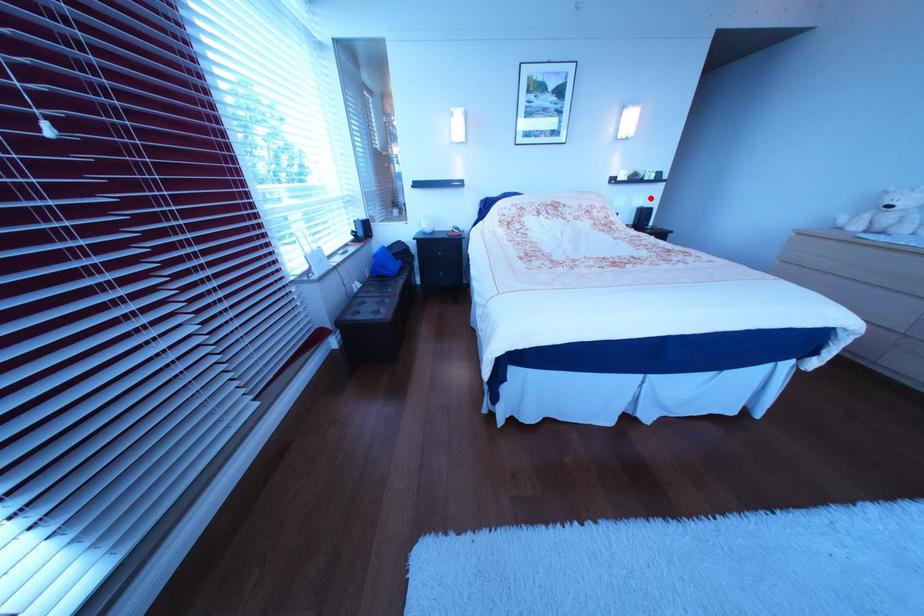
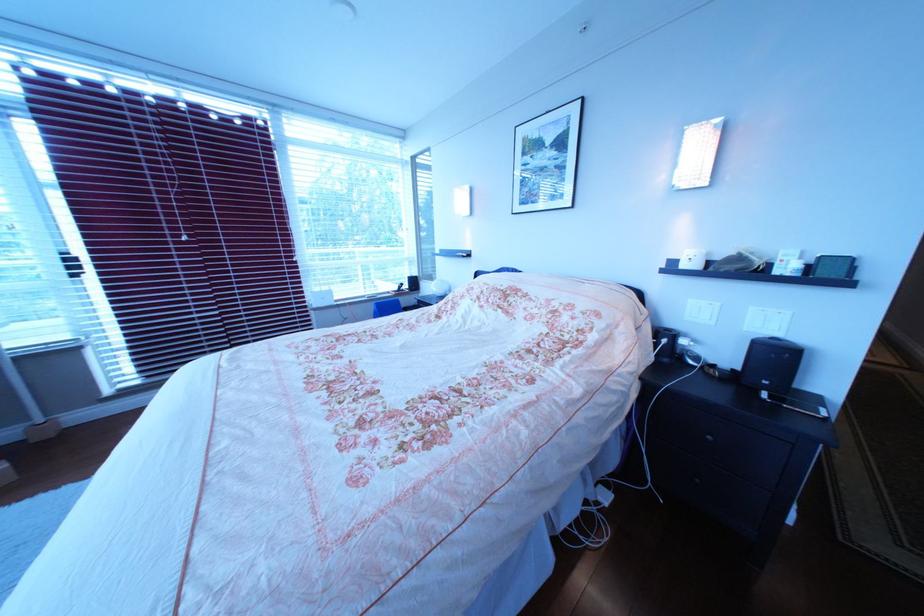
Question: A red point is marked in image1. In image2, is the corresponding 3D point closer to the camera or farther? Reply with the corresponding letter.

Choices:
 (A) The corresponding 3D point is closer.
 (B) The corresponding 3D point is farther.

Answer: (B)